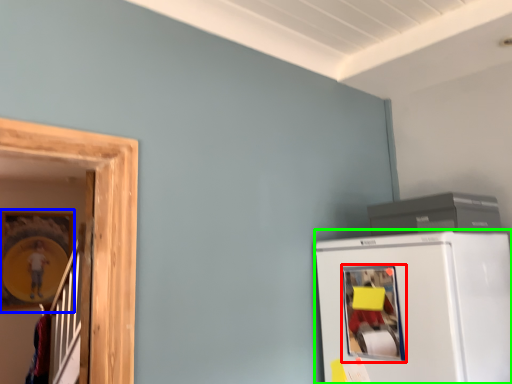
Question: Which object is positioned farthest from window (highlighted by a red box)? Select from picture frame (highlighted by a blue box) and refrigerator (highlighted by a green box).

Choices:
 (A) picture frame
 (B) refrigerator

Answer: (A)